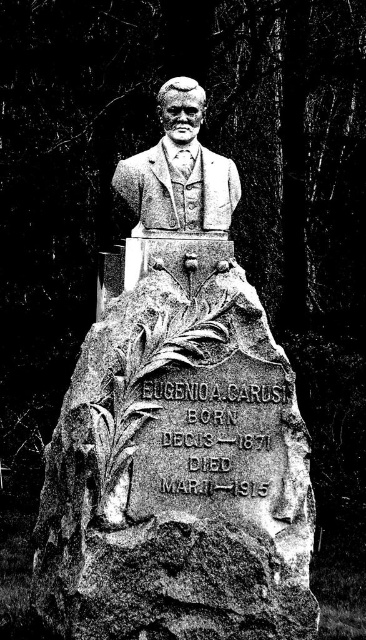
Does stone statue at center have a lesser height compared to polished stone bust at center?

In fact, stone statue at center may be taller than polished stone bust at center.

Between stone statue at center and polished stone bust at center, which one is positioned higher?

Positioned higher is polished stone bust at center.

Is point (311, 516) behind point (233, 186)?

That is False.

The image size is (366, 640). I want to click on stone statue at center, so click(x=177, y=429).